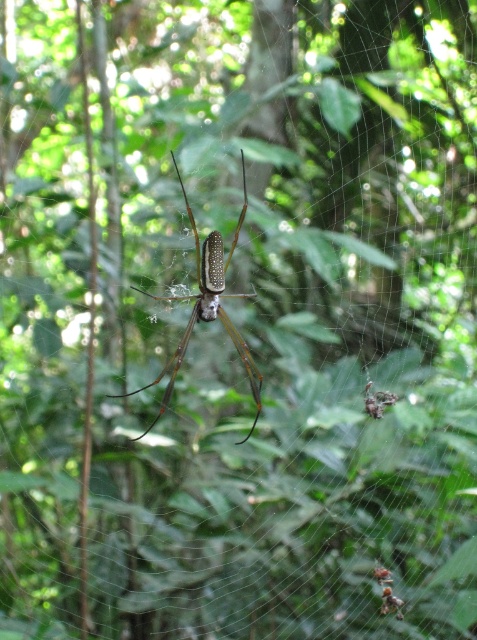
In the scene shown: Does translucent silk orb at center have a larger size compared to shiny metallic spider at center?

No.

Is translucent silk orb at center to the right of shiny metallic spider at center from the viewer's perspective?

Indeed, translucent silk orb at center is positioned on the right side of shiny metallic spider at center.

Describe the element at coordinates (387, 593) in the screenshot. I see `translucent silk orb at center` at that location.

You are a GUI agent. You are given a task and a screenshot of the screen. Output one action in this format:
    pyautogui.click(x=<x>, y=<y>)
    Task: Click on the translucent silk orb at center
    
    Given the screenshot: What is the action you would take?
    pyautogui.click(x=387, y=593)

Does shiny brown spider at center appear over shiny metallic spider at center?

Yes, shiny brown spider at center is above shiny metallic spider at center.

Which is in front, point (209, 285) or point (393, 396)?

Point (393, 396)

Who is more forward, (206, 320) or (374, 401)?

Point (374, 401) is in front.

Identify the location of shiny brown spider at center. The image size is (477, 640). (207, 307).

Does shiny brown spider at center appear under translucent silk orb at center?

No.

Is shiny brown spider at center positioned in front of translucent silk orb at center?

Yes.

The width and height of the screenshot is (477, 640). What do you see at coordinates (207, 307) in the screenshot? I see `shiny brown spider at center` at bounding box center [207, 307].

The height and width of the screenshot is (640, 477). I want to click on shiny brown spider at center, so click(x=207, y=307).